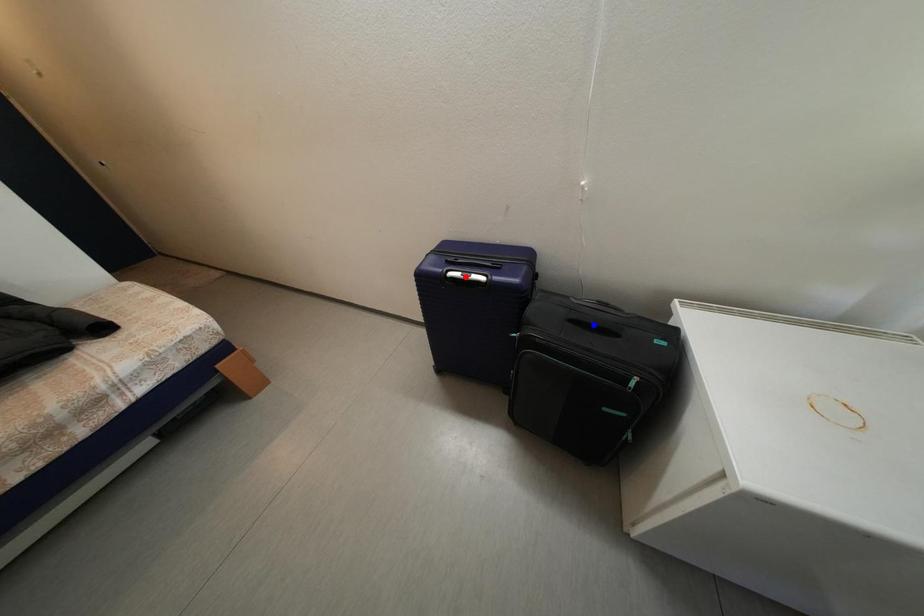
Question: Which of the two points in the image is closer to the camera?

Choices:
 (A) Blue point is closer.
 (B) Red point is closer.

Answer: (A)